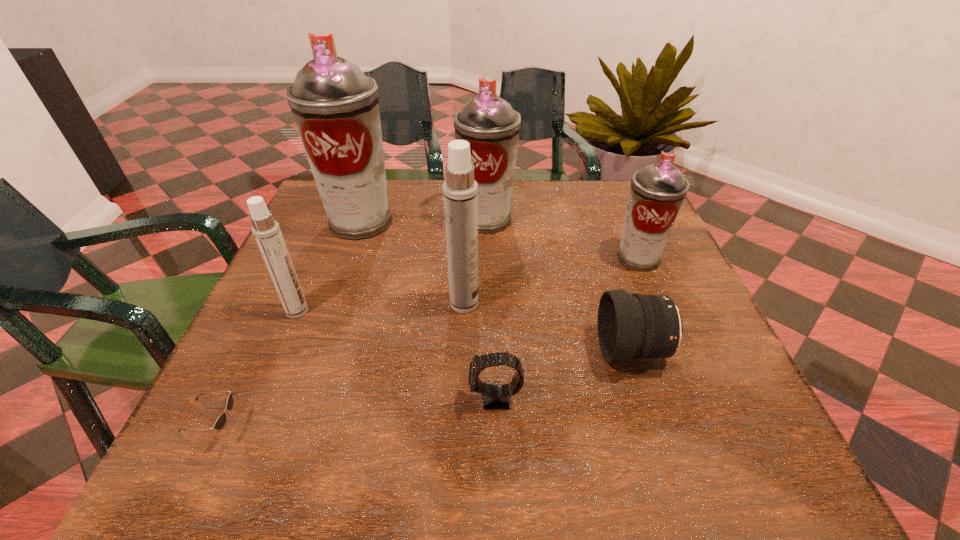
Where is `the leftmost gray aerosol can`? This screenshot has width=960, height=540. the leftmost gray aerosol can is located at coordinates (x=335, y=106).

Locate an element on the screen. the biggest gray aerosol can is located at coordinates (335, 106).

Find the location of `the second smallest gray aerosol can`. the second smallest gray aerosol can is located at coordinates (490, 125).

Where is `the right white aerosol can`? the right white aerosol can is located at coordinates (460, 191).

At what (x,y) coordinates should I click in order to perform the action: click on the rightmost aerosol can. Please return your answer as a coordinate pair (x, y). This screenshot has width=960, height=540. Looking at the image, I should click on (657, 191).

Locate an element on the screen. the smallest gray aerosol can is located at coordinates (657, 191).

You are a GUI agent. You are given a task and a screenshot of the screen. Output one action in this format:
    pyautogui.click(x=<x>, y=<y>)
    Task: Click on the smaller white aerosol can
    
    Given the screenshot: What is the action you would take?
    pyautogui.click(x=267, y=233)

Find the location of `black telephoto lens`. black telephoto lens is located at coordinates (630, 326).

This screenshot has width=960, height=540. Identify the location of the third shortest object. (630, 326).

Identify the location of the second shortest object. The width and height of the screenshot is (960, 540). (496, 397).